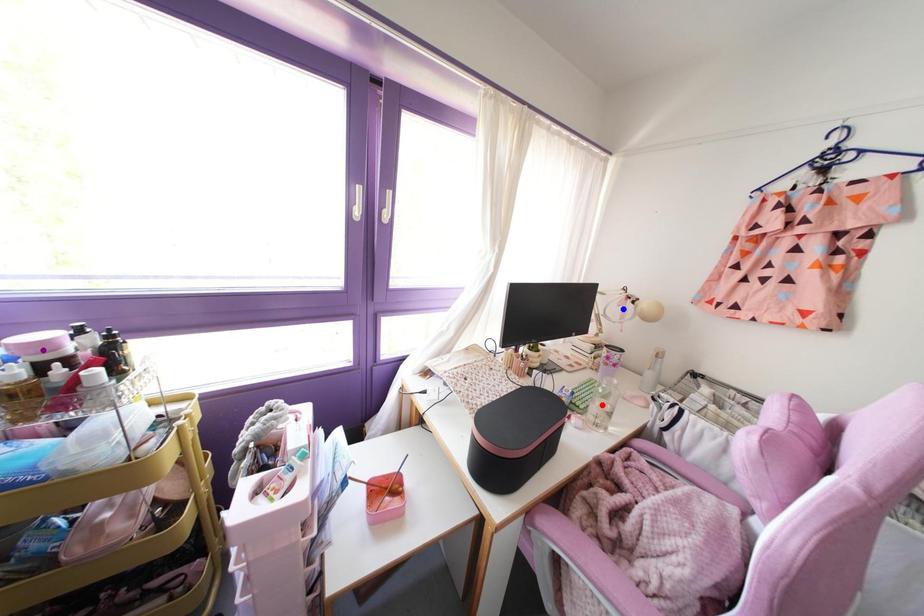
Order these from farthest to nearest:
red point
blue point
purple point

blue point < red point < purple point